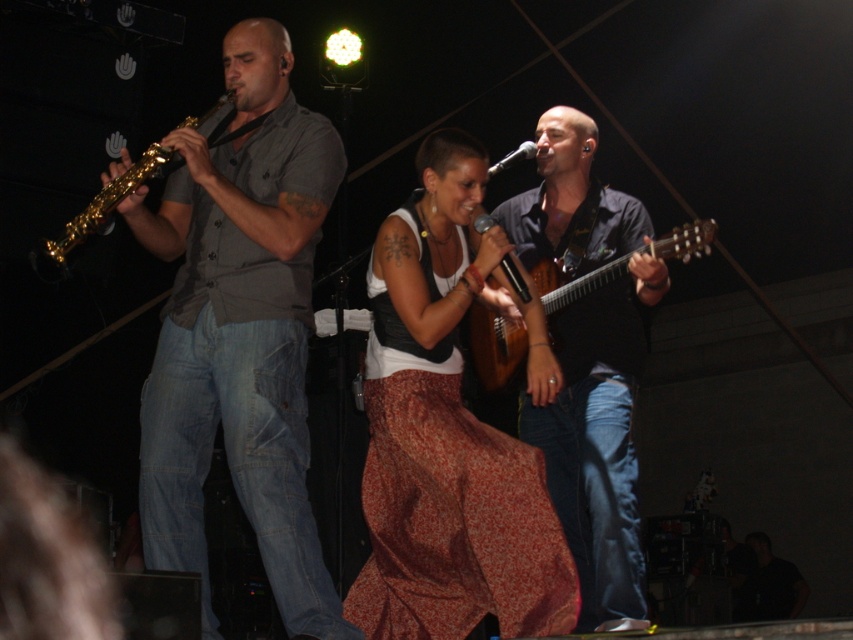
You are a photographer at the live performance and want to capture the singer in a way that emphasizes her upper body. Given that the matte gray shirt at center and the printed cotton skirt at center are both visible in the frame, which clothing item should you focus on to ensure the upper body is highlighted?

The matte gray shirt at center has a greater height compared to the printed cotton skirt at center, so focusing on the matte gray shirt at center will emphasize the upper body.

Based on the coordinates provided, which object is positioned at point [241,330]?

The matte gray shirt at center is positioned at point [241,330].